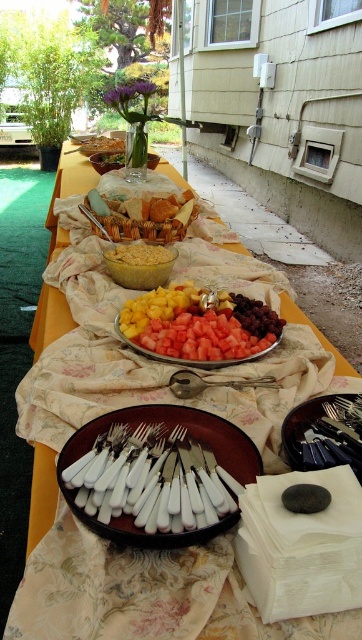
Question: In this image, where is white plastic forks at center located relative to shiny red plate at center?

Choices:
 (A) left
 (B) right

Answer: (A)

Question: Among these points, which one is nearest to the camera?

Choices:
 (A) (82, 481)
 (B) (195, 305)
 (C) (179, 396)

Answer: (A)

Question: Which of the following is the farthest from the observer?

Choices:
 (A) (132, 312)
 (B) (233, 502)
 (C) (207, 378)

Answer: (A)

Question: Can you confirm if shiny red plate at center is bigger than silver spoon at center?

Choices:
 (A) no
 (B) yes

Answer: (B)

Question: Which point is farther to the camera?

Choices:
 (A) shiny red plate at center
 (B) silver spoon at center
 (C) white plastic forks at center

Answer: (A)

Question: Is white plastic forks at center further to camera compared to silver spoon at center?

Choices:
 (A) no
 (B) yes

Answer: (A)